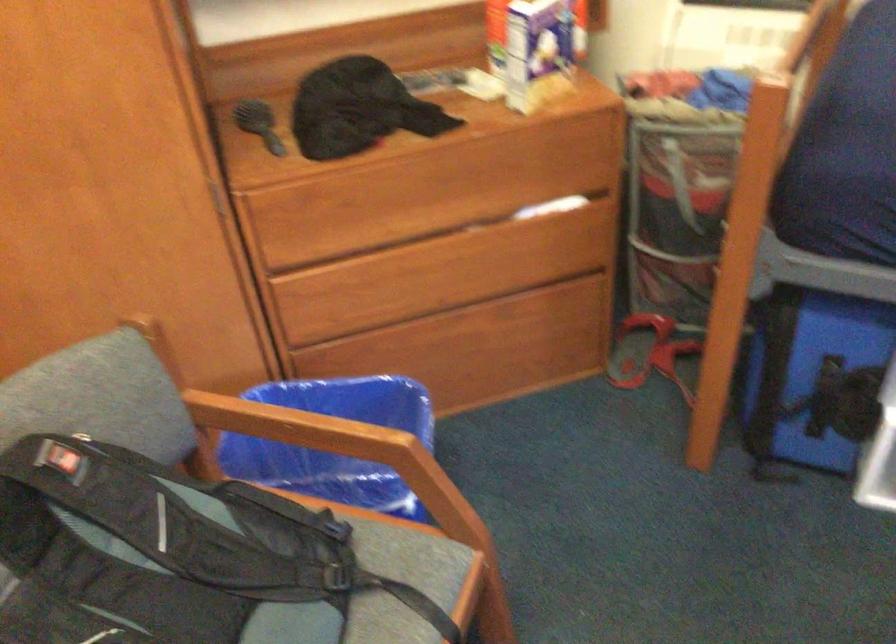
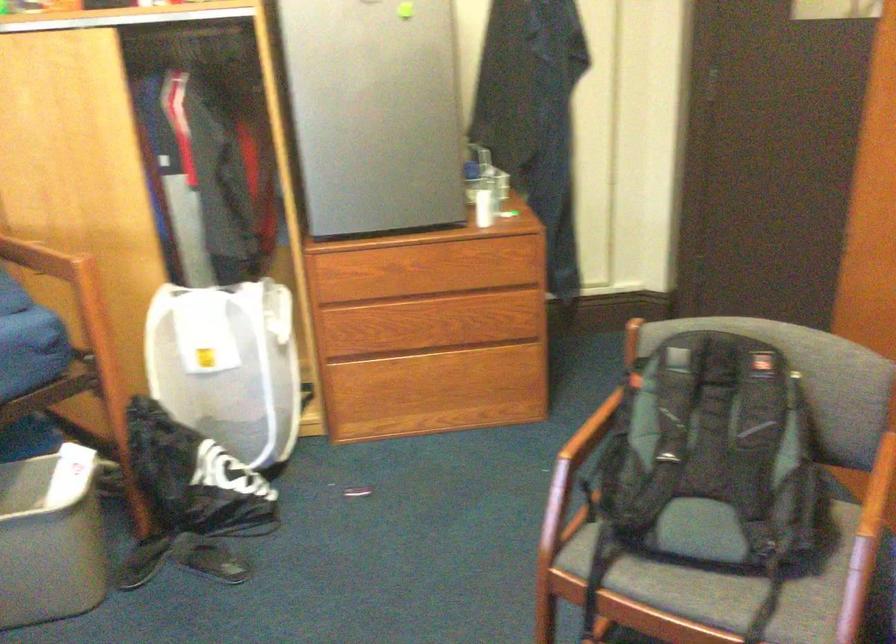
Based on the continuous images, in which direction is the camera rotating?

The camera rotated toward left-down.